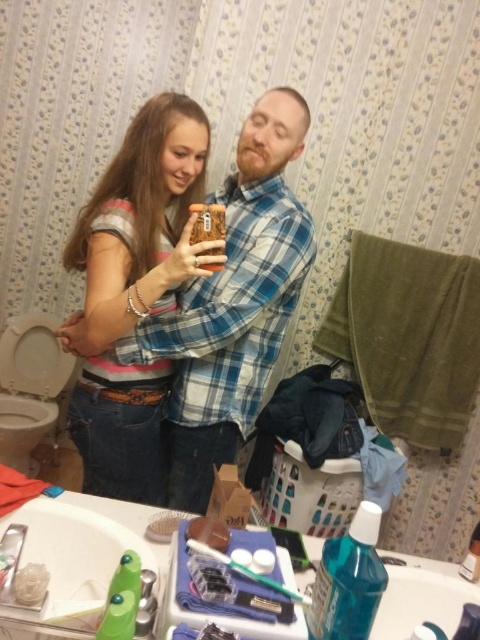
Question: Is striped cotton shirt at center to the left of translucent blue plastic mouthwash at lower right from the viewer's perspective?

Choices:
 (A) no
 (B) yes

Answer: (B)

Question: Does striped cotton shirt at center appear on the left side of translucent blue plastic mouthwash at lower right?

Choices:
 (A) no
 (B) yes

Answer: (B)

Question: Which object is farther from the camera taking this photo?

Choices:
 (A) striped cotton shirt at center
 (B) translucent blue plastic mouthwash at lower right

Answer: (A)

Question: Which point appears farthest from the camera in this image?

Choices:
 (A) [370, 547]
 (B) [124, 198]

Answer: (B)

Question: Observing the image, what is the correct spatial positioning of striped cotton shirt at center in reference to translucent blue plastic mouthwash at lower right?

Choices:
 (A) left
 (B) right

Answer: (A)